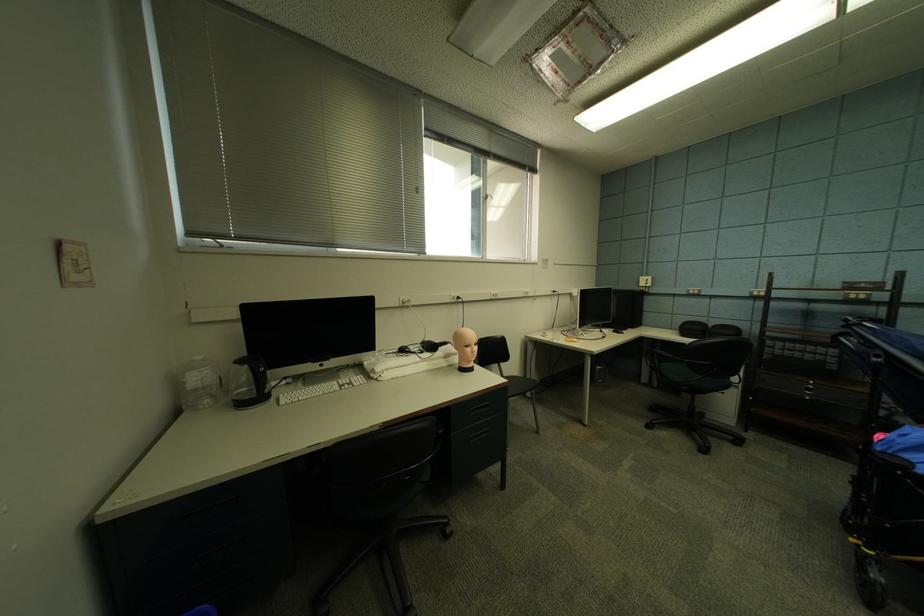
I want to click on clear water jug, so click(x=199, y=384).